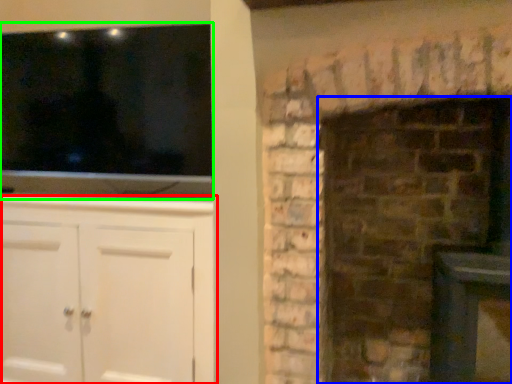
Question: Based on their relative distances, which object is farther from cabinetry (highlighted by a red box)? Choose from fireplace (highlighted by a blue box) and window (highlighted by a green box).

Choices:
 (A) fireplace
 (B) window

Answer: (A)